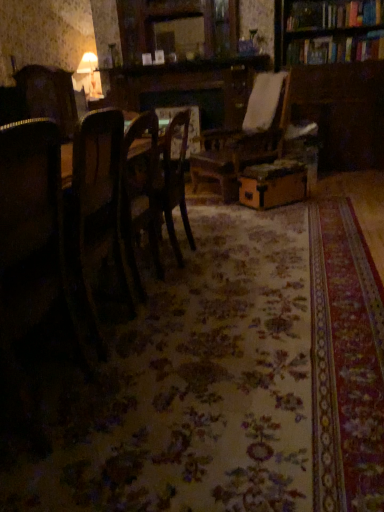
Question: Considering the relative sizes of dark wood chair at left, which is the second chair in front-to-back order, and matte white lampshade at upper left in the image provided, is dark wood chair at left, which is the second chair in front-to-back order, smaller than matte white lampshade at upper left?

Choices:
 (A) no
 (B) yes

Answer: (B)

Question: Is dark wood chair at left, the second chair in the back-to-front sequence, wider than matte white lampshade at upper left?

Choices:
 (A) no
 (B) yes

Answer: (B)

Question: Is matte white lampshade at upper left at the back of dark wood chair at left, which is the second chair in front-to-back order?

Choices:
 (A) no
 (B) yes

Answer: (A)

Question: Considering the relative sizes of dark wood chair at left, the second chair in the back-to-front sequence, and matte white lampshade at upper left in the image provided, is dark wood chair at left, the second chair in the back-to-front sequence, taller than matte white lampshade at upper left?

Choices:
 (A) no
 (B) yes

Answer: (A)

Question: Is dark wood chair at left, the second chair in the back-to-front sequence, outside matte white lampshade at upper left?

Choices:
 (A) yes
 (B) no

Answer: (A)

Question: From the image's perspective, is dark wood chair at left, the second chair in the back-to-front sequence, above matte white lampshade at upper left?

Choices:
 (A) yes
 (B) no

Answer: (B)

Question: Is matte white lampshade at upper left shorter than wooden bookcase at upper right?

Choices:
 (A) no
 (B) yes

Answer: (B)

Question: Is matte white lampshade at upper left thinner than wooden bookcase at upper right?

Choices:
 (A) yes
 (B) no

Answer: (A)

Question: From the image's perspective, is matte white lampshade at upper left on top of wooden bookcase at upper right?

Choices:
 (A) no
 (B) yes

Answer: (B)

Question: Considering the relative sizes of matte white lampshade at upper left and wooden bookcase at upper right in the image provided, is matte white lampshade at upper left wider than wooden bookcase at upper right?

Choices:
 (A) no
 (B) yes

Answer: (A)

Question: Could you tell me if matte white lampshade at upper left is turned towards wooden bookcase at upper right?

Choices:
 (A) no
 (B) yes

Answer: (A)

Question: Is matte white lampshade at upper left at the right side of wooden bookcase at upper right?

Choices:
 (A) yes
 (B) no

Answer: (B)

Question: Can you confirm if dark wood chair at left, which is the second chair in front-to-back order, is positioned to the right of wooden chair at center, arranged as the 3th chair when viewed from the front?

Choices:
 (A) no
 (B) yes

Answer: (A)